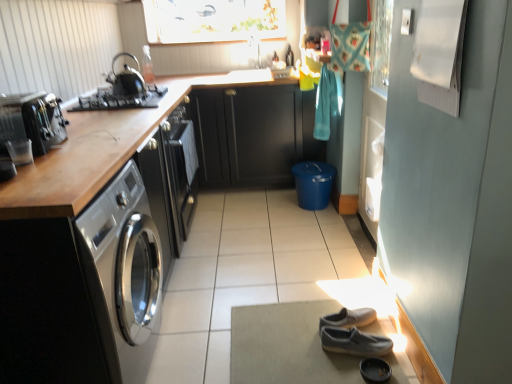
This screenshot has width=512, height=384. Identify the location of vacant space to the left of black leather shoe at lower center. (334, 370).